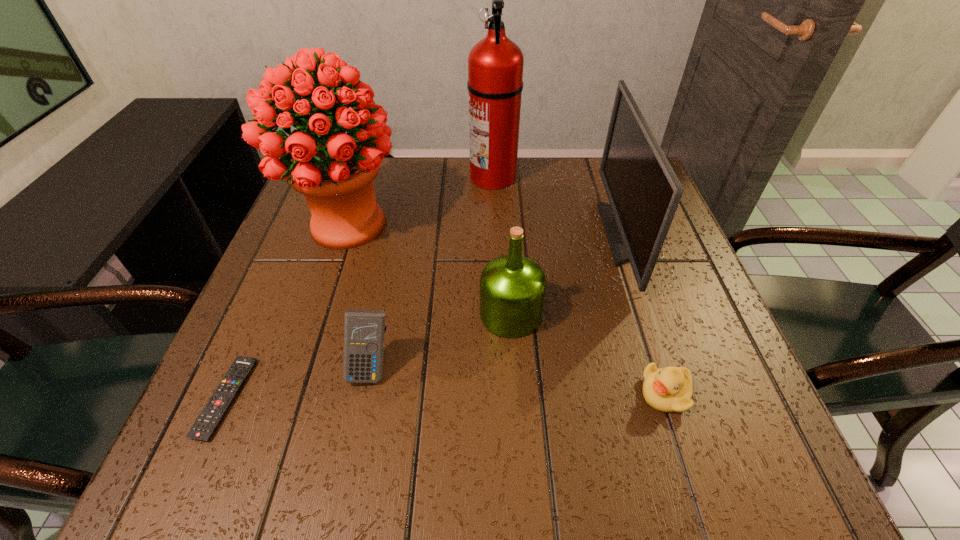
Locate an element on the screen. Image resolution: width=960 pixels, height=540 pixels. fire extinguisher is located at coordinates (495, 64).

The height and width of the screenshot is (540, 960). I want to click on bouquet, so click(334, 171).

This screenshot has width=960, height=540. Identify the location of monitor. (644, 192).

Identify the location of olive oil. The width and height of the screenshot is (960, 540). (512, 287).

Locate an element on the screen. The height and width of the screenshot is (540, 960). the fifth tallest object is located at coordinates (364, 330).

Where is `the second shortest object`? the second shortest object is located at coordinates (669, 389).

Identify the location of the shortest object. The width and height of the screenshot is (960, 540). (209, 419).

Identify the location of free space located at the nozzle of the fire extinguisher. 403,177.

Where is `vacant region located at the nozzle of the fire extinguisher`? vacant region located at the nozzle of the fire extinguisher is located at coordinates 337,177.

The height and width of the screenshot is (540, 960). Identify the location of vacant area located 0.080m at the nozzle of the fire extinguisher. (440, 177).